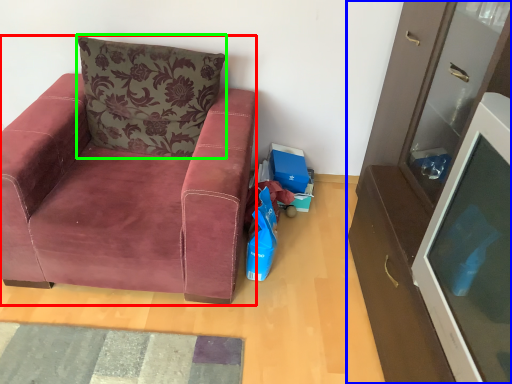
Question: Which object is the closest to the chair (highlighted by a red box)? Choose among these: cabinetry (highlighted by a blue box) or pillow (highlighted by a green box).

Choices:
 (A) cabinetry
 (B) pillow

Answer: (B)